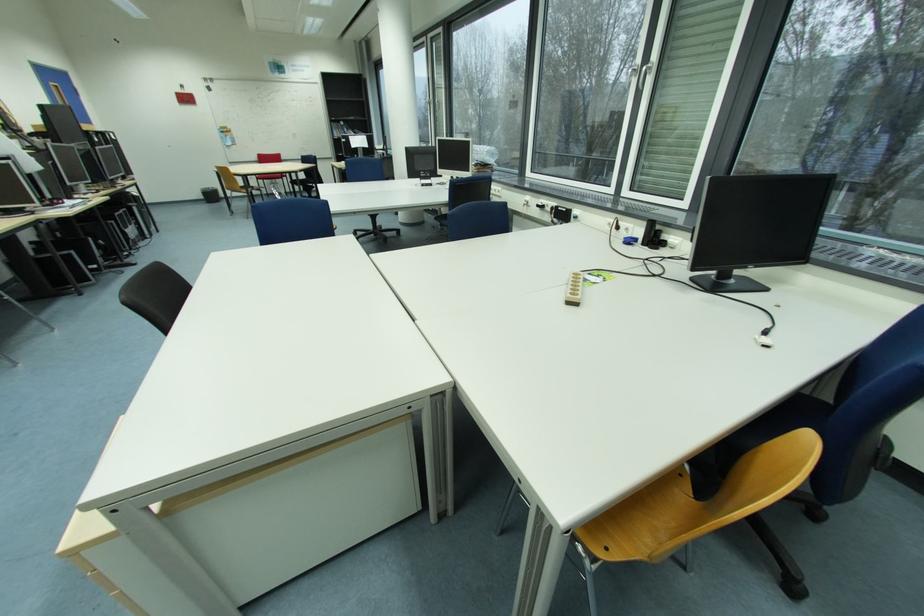
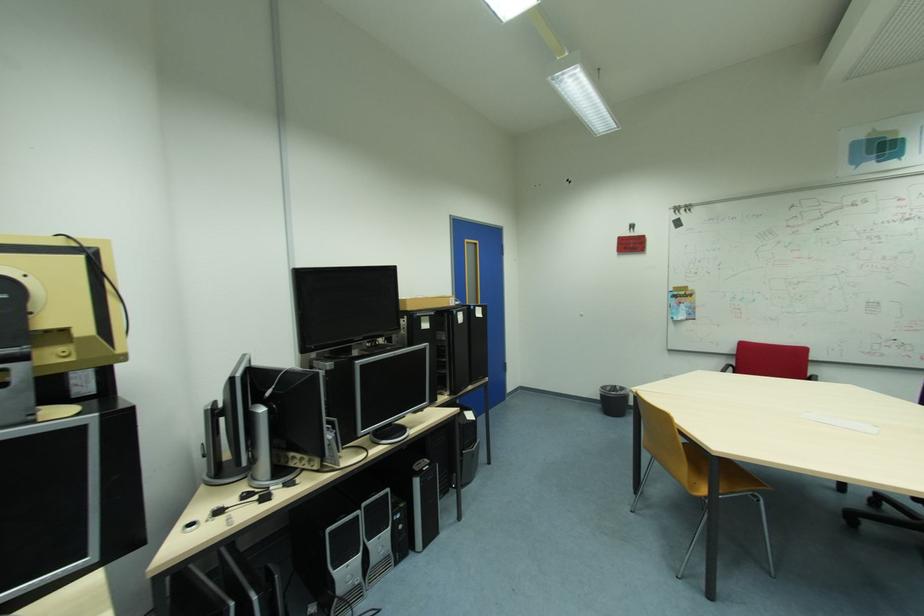
Where in the second image is the point corresponding to point (209, 198) from the first image?

(605, 400)